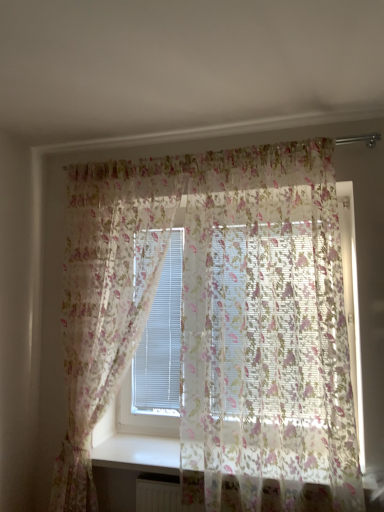
Question: From a real-world perspective, relative to translucent floral curtain at upper center, the 1th curtain from the right, is translucent floral fabric at center, which is the 2th curtain in right-to-left order, vertically above or below?

Choices:
 (A) above
 (B) below

Answer: (B)

Question: From the image's perspective, is translucent floral fabric at center, the 1th curtain viewed from the left, above or below translucent floral curtain at upper center, arranged as the second curtain when viewed from the left?

Choices:
 (A) above
 (B) below

Answer: (B)

Question: In terms of size, does translucent floral fabric at center, the 1th curtain viewed from the left, appear bigger or smaller than translucent floral curtain at upper center, the 1th curtain from the right?

Choices:
 (A) big
 (B) small

Answer: (B)

Question: In terms of width, does translucent floral curtain at upper center, arranged as the second curtain when viewed from the left, look wider or thinner when compared to translucent floral fabric at center, which is the 2th curtain in right-to-left order?

Choices:
 (A) wide
 (B) thin

Answer: (A)

Question: From the image's perspective, is translucent floral curtain at upper center, the 1th curtain from the right, above or below translucent floral fabric at center, the 1th curtain viewed from the left?

Choices:
 (A) below
 (B) above

Answer: (B)

Question: Considering the positions of translucent floral curtain at upper center, arranged as the second curtain when viewed from the left, and translucent floral fabric at center, which is the 2th curtain in right-to-left order, in the image, is translucent floral curtain at upper center, arranged as the second curtain when viewed from the left, taller or shorter than translucent floral fabric at center, which is the 2th curtain in right-to-left order,?

Choices:
 (A) short
 (B) tall

Answer: (A)

Question: Do you think translucent floral curtain at upper center, the 1th curtain from the right, is within translucent floral fabric at center, which is the 2th curtain in right-to-left order, or outside of it?

Choices:
 (A) outside
 (B) inside

Answer: (A)